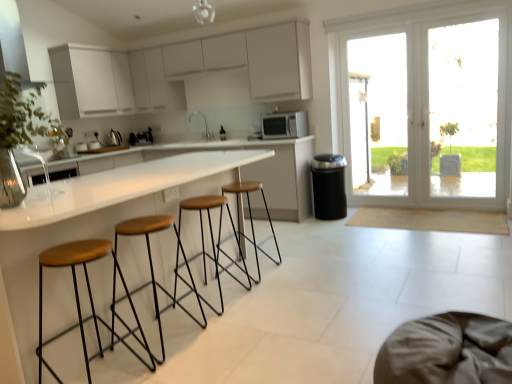
The image size is (512, 384). I want to click on free space in front of wooden seat stool at center, the second stool from the front, so click(x=183, y=366).